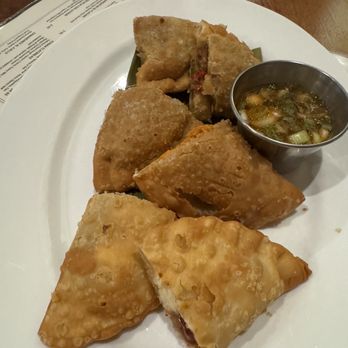
This screenshot has width=348, height=348. Find the location of `plate rim`. plate rim is located at coordinates (28, 206).